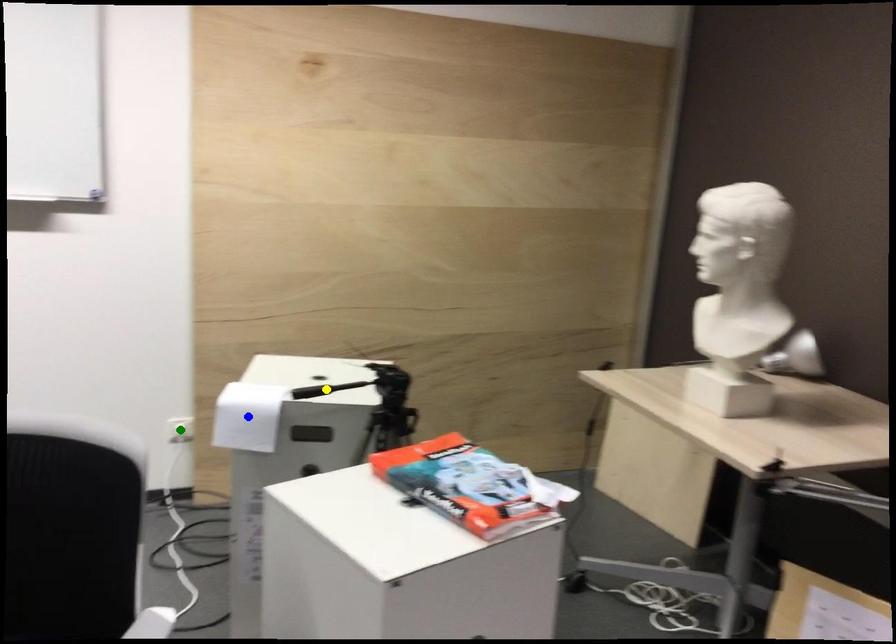
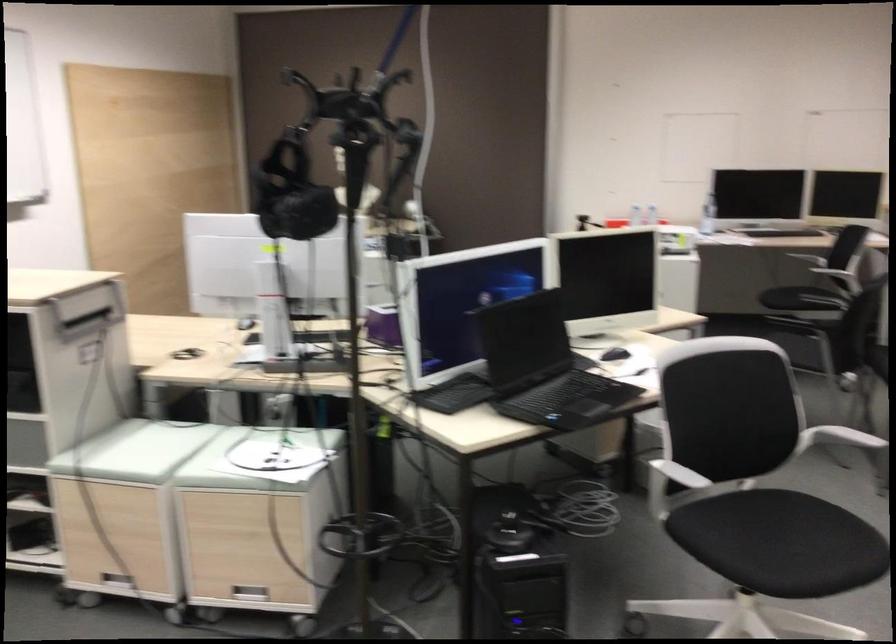
I am providing you with two images of the same scene from different viewpoints. Three points are marked in image1. Which point corresponds to a part or object that is occluded in image2?In image1, three points are marked. Which of them correspond to a part or object that is occluded in image2?Among the three points shown in image1, which one corresponds to a part or object that is no longer visible due to occlusion in image2?

Invisible in image2: green point, yellow point, blue point.